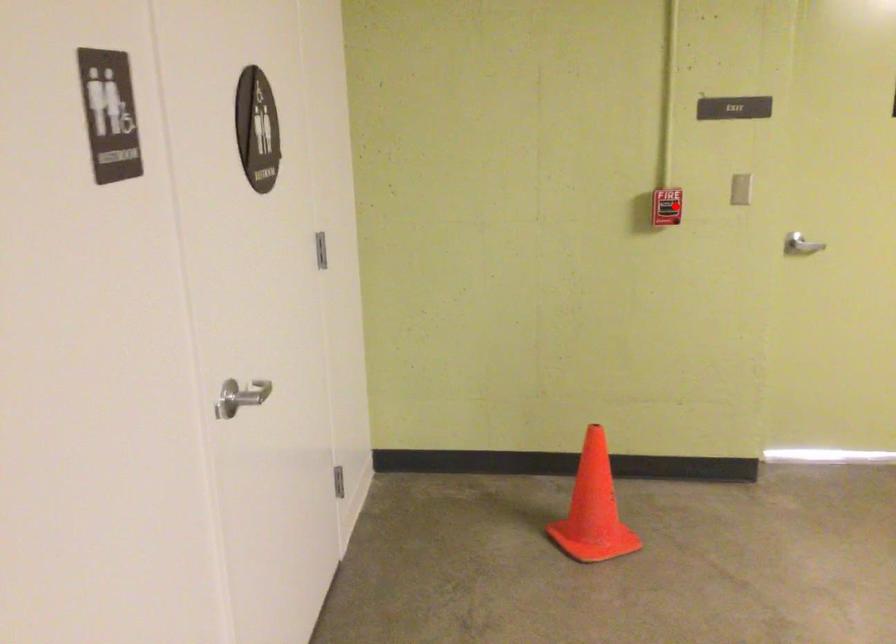
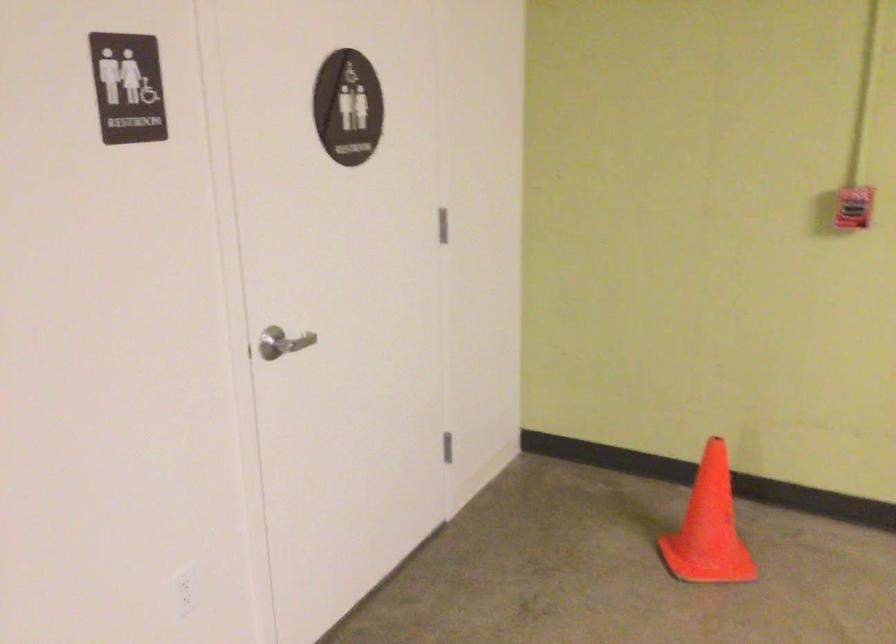
Question: I am providing you with two images of the same scene from different viewpoints. Image1 has a red point marked. In image2, the corresponding 3D location appears at what relative position? Reply with the corresponding letter.

Choices:
 (A) Closer
 (B) Farther

Answer: (A)